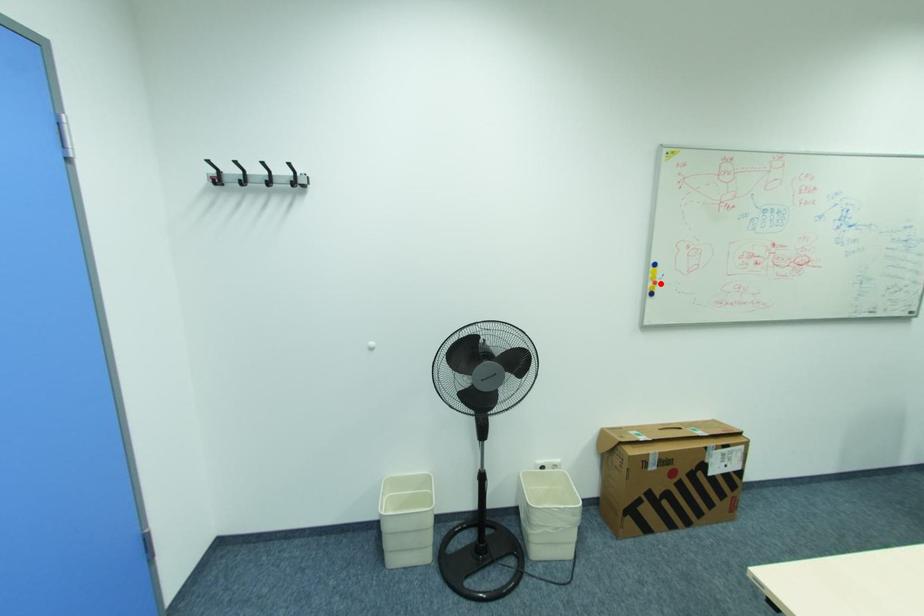
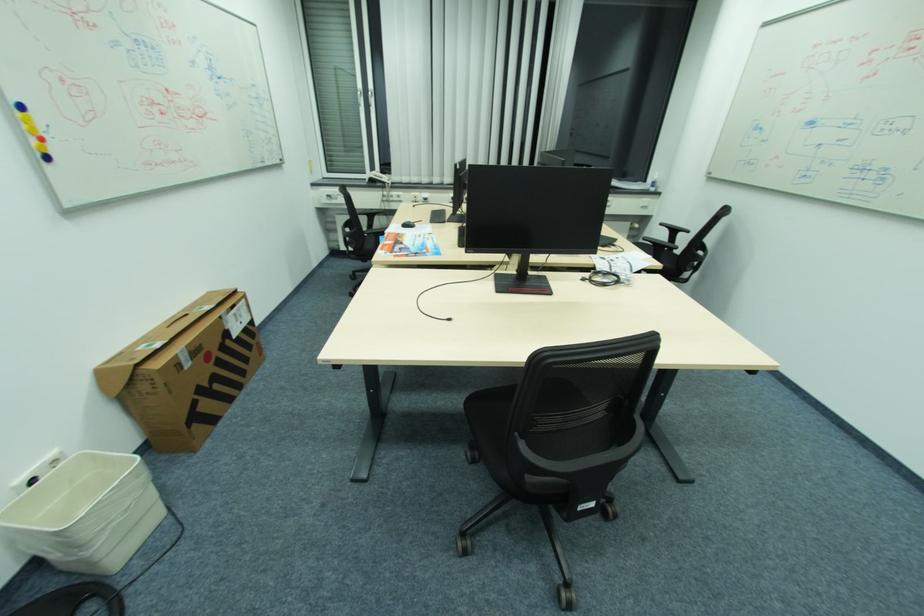
Question: I am providing you with two images of the same scene from different viewpoints. A red point is shown in image1. For the corresponding object point in image2, is it positioned nearer or farther from the camera?

Choices:
 (A) Nearer
 (B) Farther

Answer: (B)